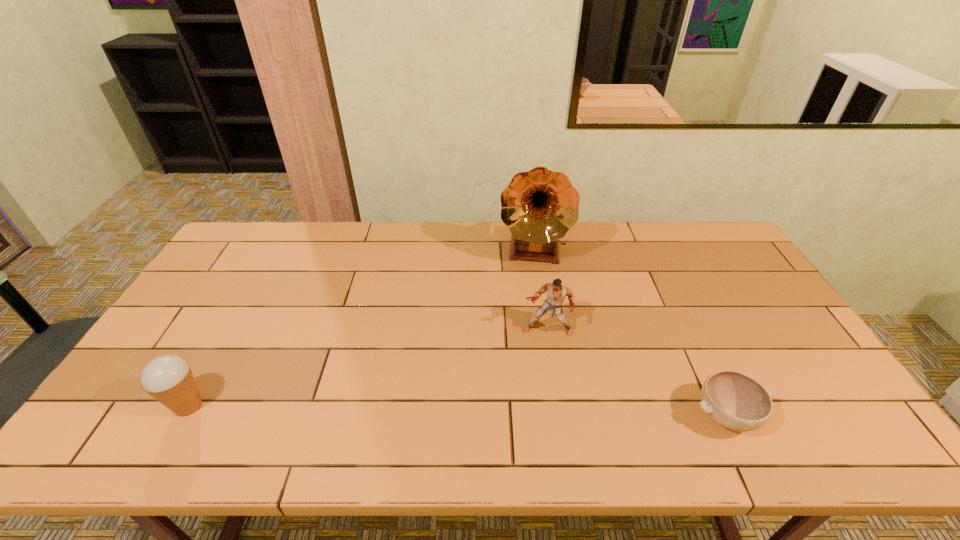
Where is `vacant spot on the desktop that is between the icecream and the shortest object and is positioned on the front-facing side of the third nearest object`? This screenshot has width=960, height=540. vacant spot on the desktop that is between the icecream and the shortest object and is positioned on the front-facing side of the third nearest object is located at coordinates (527, 412).

Locate an element on the screen. Image resolution: width=960 pixels, height=540 pixels. vacant space on the desktop that is between the icecream and the rightmost object and is positioned on the horn of the phonograph_record is located at coordinates (521, 412).